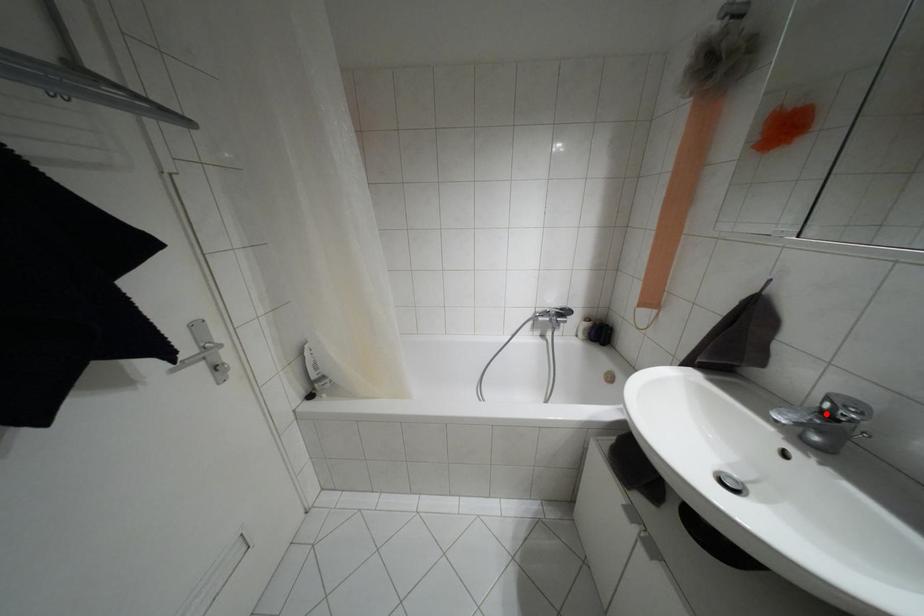
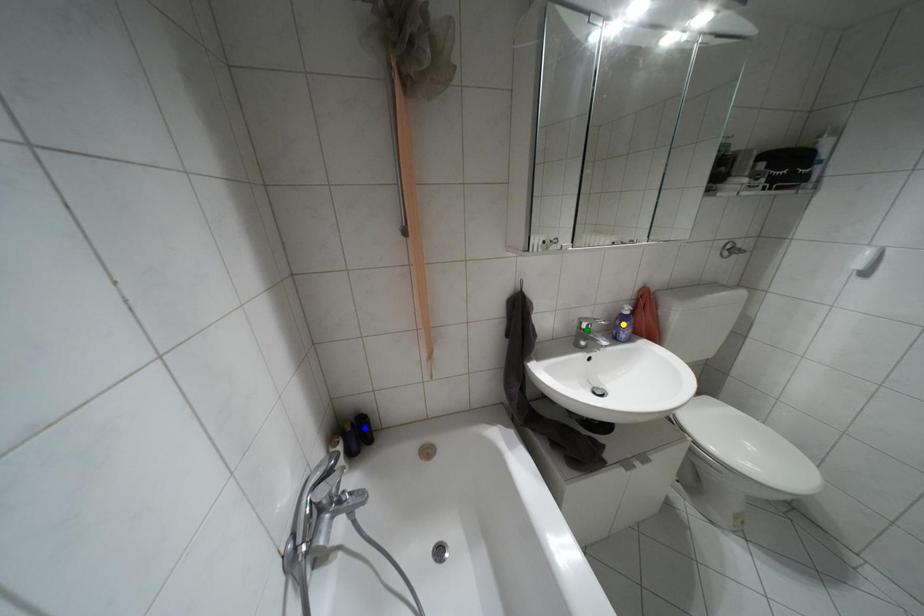
Question: I am providing you with two images of the same scene from different viewpoints. A red point is marked on the first image. You are given multiple points on the second image. Which spot in image 2 lines up with the point in image 1?

Choices:
 (A) yellow point
 (B) green point
 (C) blue point

Answer: (B)